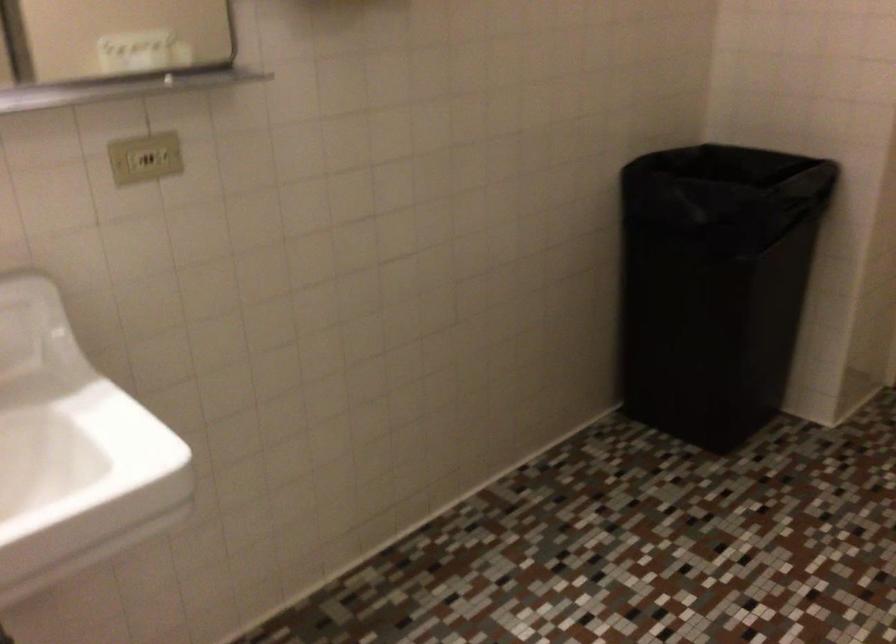
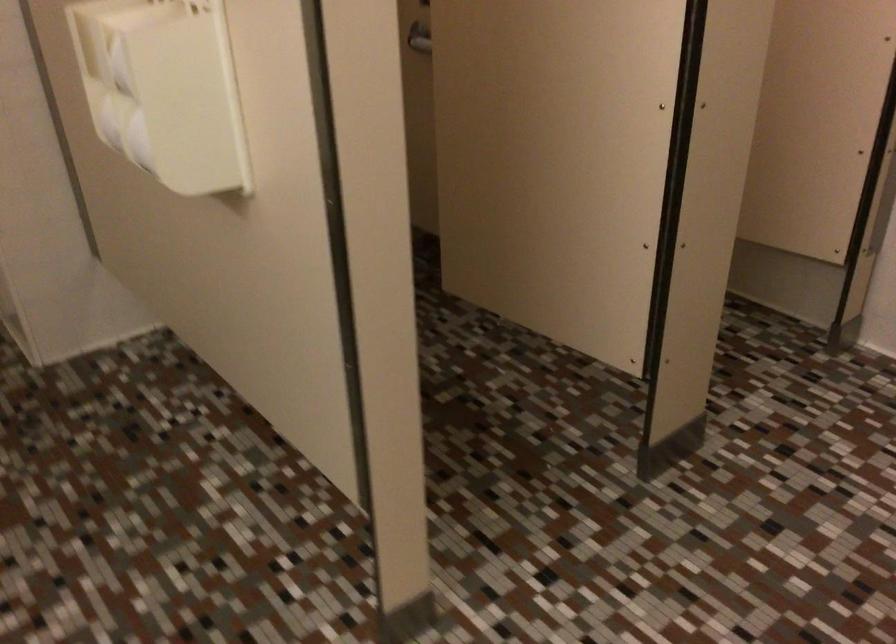
The images are taken continuously from a first-person perspective. In which direction is your viewpoint rotating?

The camera rotated toward right-down.